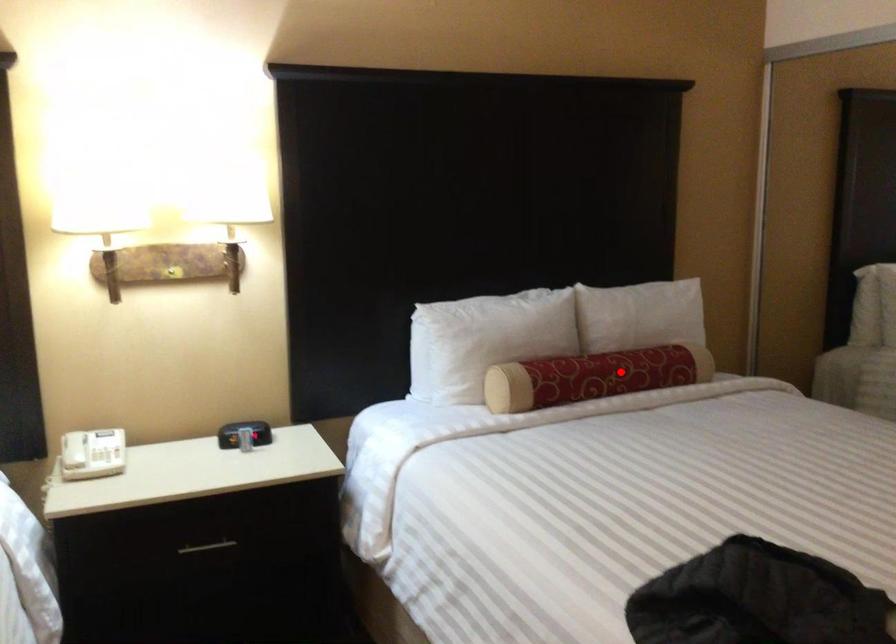
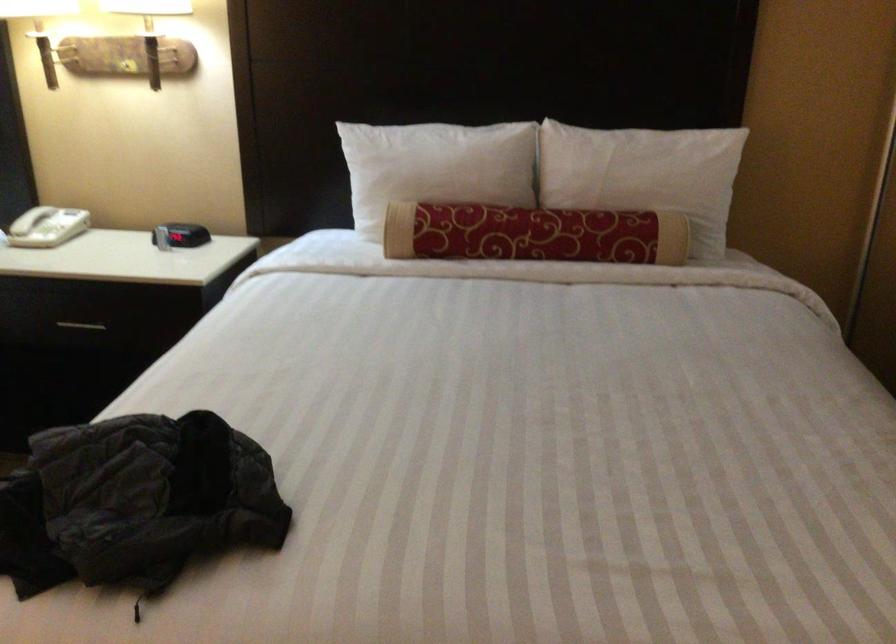
Question: I am providing you with two images of the same scene from different viewpoints. Image1 has a red point marked. In image2, the corresponding 3D location appears at what relative position? Reply with the corresponding letter.

Choices:
 (A) Closer
 (B) Farther

Answer: (A)